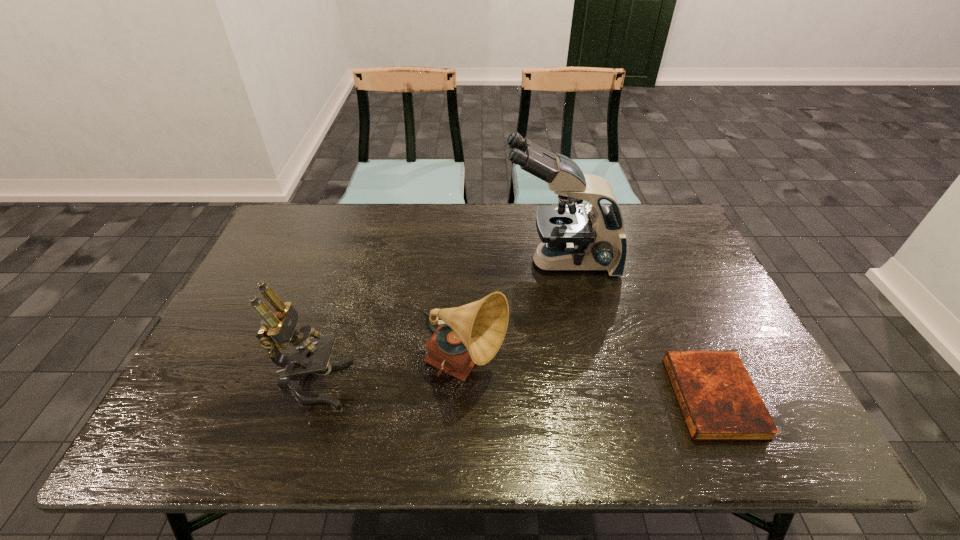
At what (x,y) coordinates should I click in order to perform the action: click on free space located at the eyepieces of the leftmost object. Please return your answer as a coordinate pair (x, y). This screenshot has width=960, height=540. Looking at the image, I should click on (498, 384).

The image size is (960, 540). What are the coordinates of `vacant space positioned on the horn of the third object from right to left` in the screenshot? It's located at (586, 368).

Identify the location of free space located on the spine side of the rightmost object. (645, 397).

The image size is (960, 540). What are the coordinates of `free location located 0.280m on the spine side of the rightmost object` in the screenshot? It's located at (553, 397).

You are a GUI agent. You are given a task and a screenshot of the screen. Output one action in this format:
    pyautogui.click(x=<x>, y=<y>)
    Task: Click on the vacant point located 0.050m on the spine side of the rightmost object
    The width and height of the screenshot is (960, 540).
    Given the screenshot: What is the action you would take?
    pyautogui.click(x=654, y=397)

Locate an element on the screen. object present at the far edge is located at coordinates [571, 239].

Identify the location of object that is at the near edge. The width and height of the screenshot is (960, 540). (719, 401).

The width and height of the screenshot is (960, 540). I want to click on object that is at the right edge, so click(x=719, y=401).

Find the location of a particular element. Image resolution: width=960 pixels, height=540 pixels. object located at the near right corner is located at coordinates (719, 401).

The height and width of the screenshot is (540, 960). In the image, there is a desktop. In order to click on vacant space at the far edge in this screenshot , I will do `click(460, 221)`.